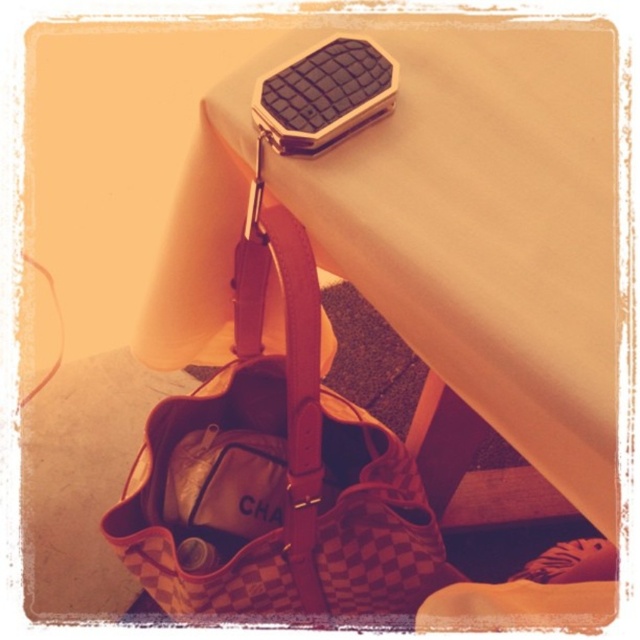
Question: Which object is closer to the camera taking this photo?

Choices:
 (A) black textured box at upper center
 (B) checkerboard fabric handbag at center
 (C) leather at lower right
 (D) leather strap at upper center

Answer: (A)

Question: Is checkerboard fabric handbag at center thinner than leather strap at upper center?

Choices:
 (A) no
 (B) yes

Answer: (A)

Question: Can you confirm if checkerboard fabric handbag at center is thinner than leather at lower right?

Choices:
 (A) yes
 (B) no

Answer: (B)

Question: Which point is farther to the camera?

Choices:
 (A) (566, 582)
 (B) (432, 358)
 (C) (340, 520)
 (D) (301, 593)

Answer: (A)

Question: Among these points, which one is nearest to the camera?

Choices:
 (A) (285, 292)
 (B) (588, 541)
 (C) (554, 440)

Answer: (C)

Question: Does leather strap at upper center appear on the left side of leather at lower right?

Choices:
 (A) yes
 (B) no

Answer: (A)